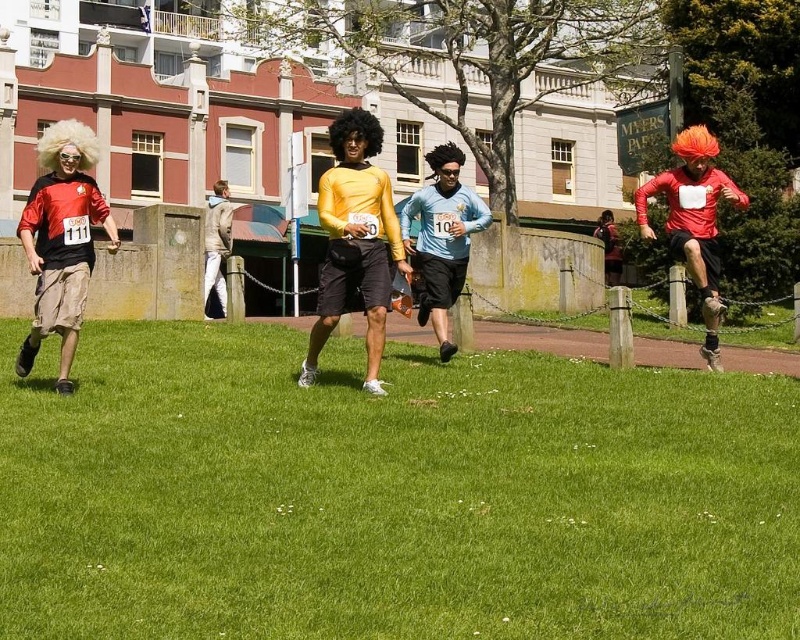
The height and width of the screenshot is (640, 800). What do you see at coordinates (61, 241) in the screenshot? I see `matte black shorts at left` at bounding box center [61, 241].

Does matte black shorts at left appear under matte orange wig at right?

Actually, matte black shorts at left is above matte orange wig at right.

Where is `matte black shorts at left`? The width and height of the screenshot is (800, 640). matte black shorts at left is located at coordinates (61, 241).

Does yellow matte shirt at center have a smaller size compared to matte orange wig at right?

Incorrect, yellow matte shirt at center is not smaller in size than matte orange wig at right.

Can you confirm if yellow matte shirt at center is shorter than matte orange wig at right?

Incorrect, yellow matte shirt at center's height does not fall short of matte orange wig at right's.

This screenshot has height=640, width=800. Describe the element at coordinates (356, 241) in the screenshot. I see `yellow matte shirt at center` at that location.

Locate an element on the screen. yellow matte shirt at center is located at coordinates (356, 241).

Does green grass at center have a larger size compared to matte orange wig at right?

Actually, green grass at center might be smaller than matte orange wig at right.

Does point (758, 449) come in front of point (686, 180)?

Yes.

Is point (85, 548) behind point (672, 170)?

No, it is in front of (672, 170).

Image resolution: width=800 pixels, height=640 pixels. What are the coordinates of `green grass at center` in the screenshot? It's located at (389, 493).